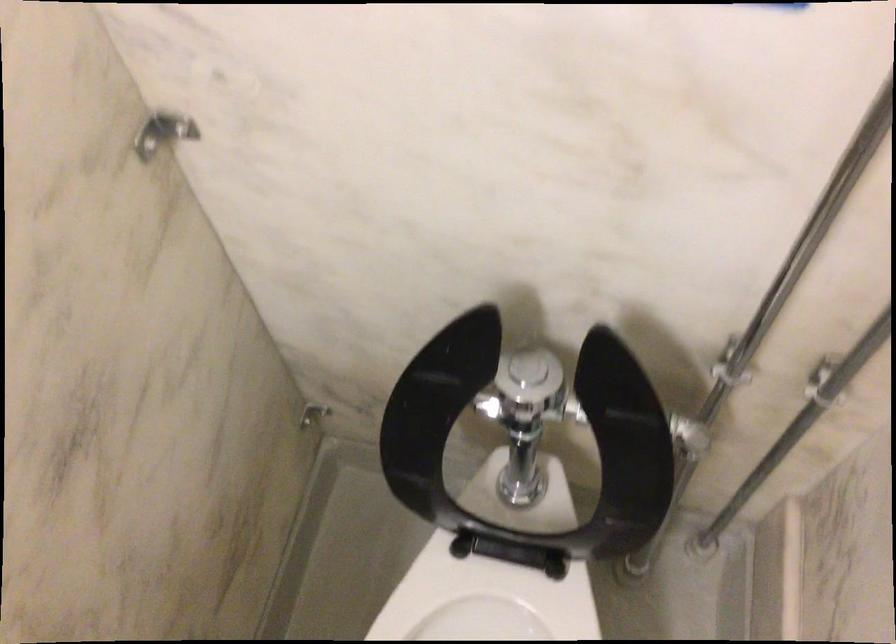
Where would you lift the black toilet seat? Please return your answer as a coordinate pair (x, y).

(487, 605)